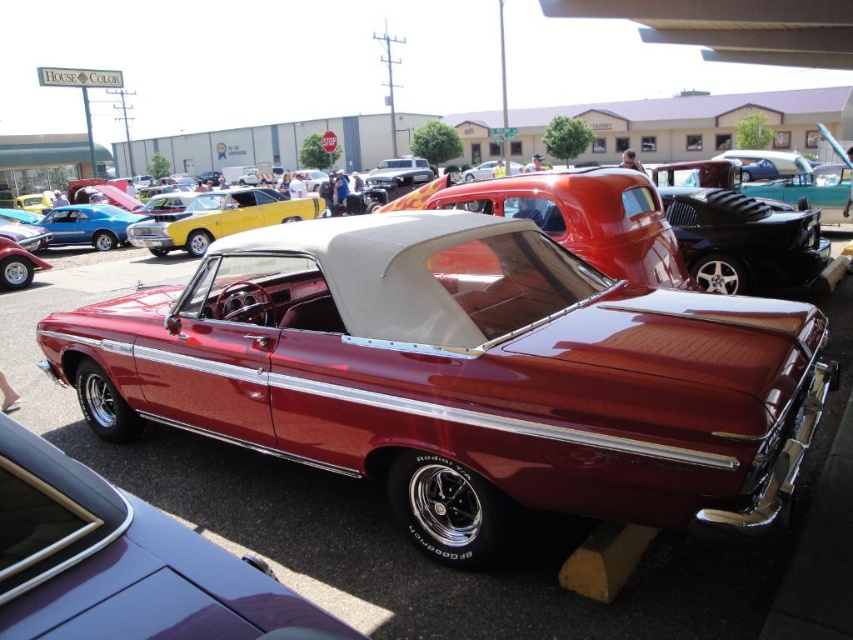
Question: Can you confirm if shiny red car at center is positioned to the right of shiny chrome car at center?

Choices:
 (A) no
 (B) yes

Answer: (B)

Question: Can you confirm if shiny red car at center is positioned to the right of shiny metallic yellow car at center?

Choices:
 (A) yes
 (B) no

Answer: (A)

Question: Is shiny metallic yellow car at center positioned before shiny chrome car at center?

Choices:
 (A) yes
 (B) no

Answer: (A)

Question: Among these objects, which one is farthest from the camera?

Choices:
 (A) shiny red car at center
 (B) shiny metallic yellow car at center

Answer: (B)

Question: Which object is farther from the camera taking this photo?

Choices:
 (A) shiny metallic yellow car at center
 (B) shiny red car at center
 (C) shiny chrome car at center

Answer: (C)

Question: Which point is closer to the camera taking this photo?

Choices:
 (A) (461, 234)
 (B) (265, 200)

Answer: (A)